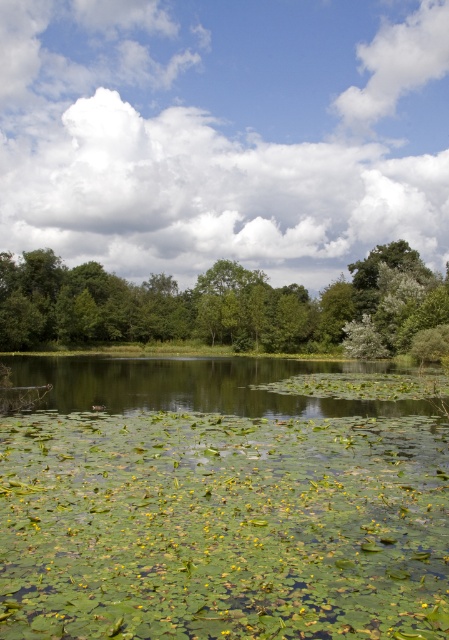
You are standing at the edge of the water and want to place a small floating decoration exactly at the center of the green leafy water at center. According to the coordinates provided, where should you position it?

The green leafy water at center is located at coordinates point (223, 500), so you should position the decoration there.

You are standing at the edge of the pond and notice both the green leafy water at center and the green leafy tree at center. Which one appears closer to you?

The green leafy water at center appears closer because it is shorter than the green leafy tree at center, making it seem nearer in the scene.

You are standing on the edge of the pond and see the green leafy water at center and the green leafy tree at center. Which one is closer to you?

The green leafy water at center is closer to you because it is positioned below the green leafy tree at center, indicating it is in a lower layer in the scene.